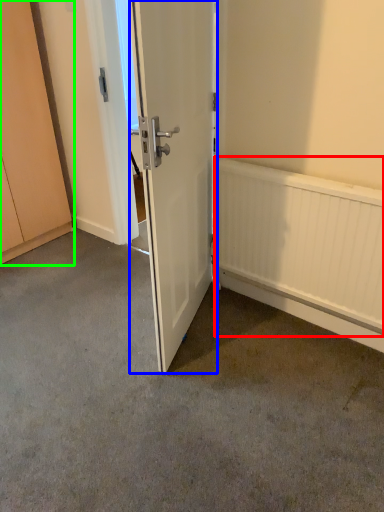
Question: Which object is positioned farthest from radiator (highlighted by a red box)? Select from door (highlighted by a blue box) and cabinetry (highlighted by a green box).

Choices:
 (A) door
 (B) cabinetry

Answer: (B)